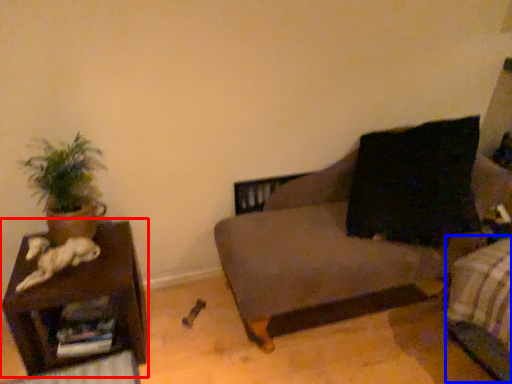
Question: Which object is further to the camera taking this photo, furniture (highlighted by a red box) or bed frame (highlighted by a blue box)?

Choices:
 (A) furniture
 (B) bed frame

Answer: (A)